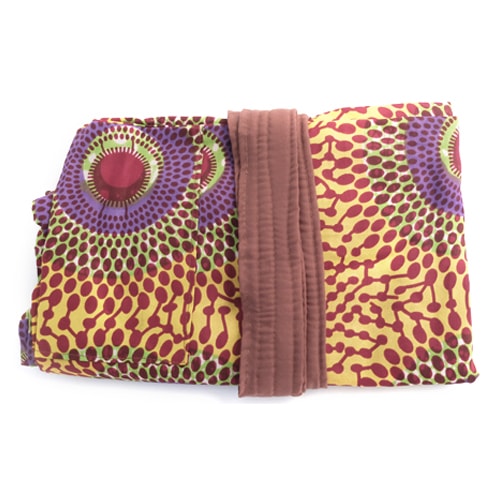
Identify the location of folded fabric. (271, 265).